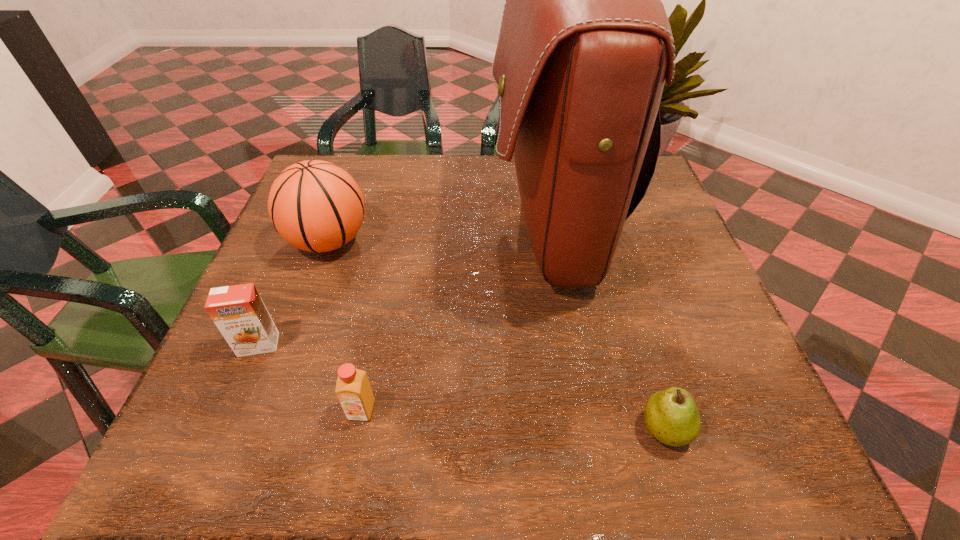
Identify which object is located as the nearest to the tallest object. Please provide its 2D coordinates. Your answer should be formatted as a tuple, i.e. [(x, y)], where the tuple contains the x and y coordinates of a point satisfying the conditions above.

[(671, 415)]

Where is `blank space that satisfies the following two spatial constraints: 1. on the open flap of the pear; 2. on the right side of the satchel`? This screenshot has width=960, height=540. blank space that satisfies the following two spatial constraints: 1. on the open flap of the pear; 2. on the right side of the satchel is located at coordinates (585, 429).

In order to click on free space that satisfies the following two spatial constraints: 1. on the open flap of the tallest object; 2. on the front side of the third farthest object in this screenshot , I will do `click(570, 345)`.

Identify the location of vacant point that satisfies the following two spatial constraints: 1. on the open flap of the tallest object; 2. on the right side of the pear. (585, 429).